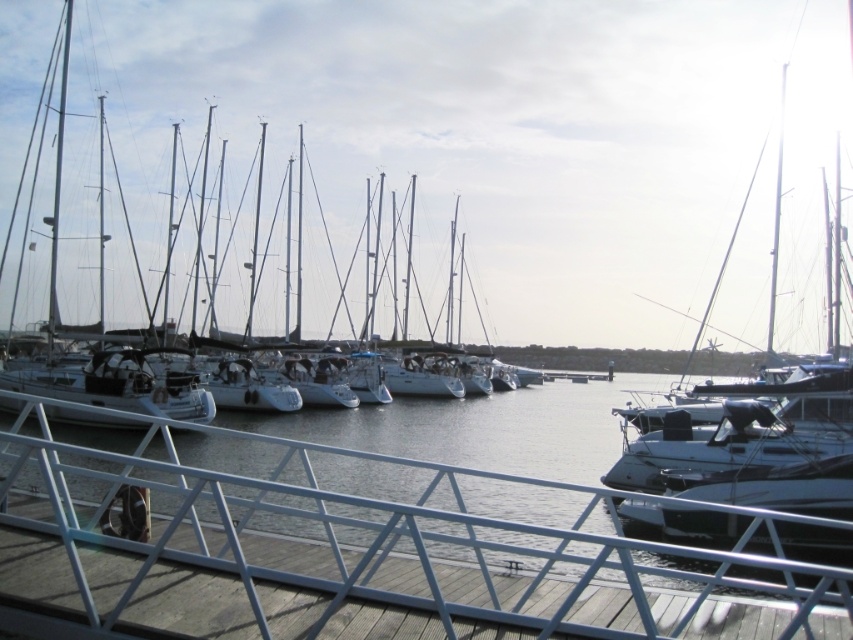
Question: In this image, where is white glossy sailboat at center located relative to white metal rail at lower center?

Choices:
 (A) right
 (B) left

Answer: (A)

Question: Which point is closer to the camera?

Choices:
 (A) (807, 584)
 (B) (303, 268)

Answer: (A)

Question: Where is white glossy sailboat at center located in relation to white metal rail at lower center in the image?

Choices:
 (A) left
 (B) right

Answer: (B)

Question: Does white glossy sailboat at center have a larger size compared to white metal rail at lower center?

Choices:
 (A) yes
 (B) no

Answer: (A)

Question: Among these points, which one is nearest to the camera?

Choices:
 (A) (502, 563)
 (B) (231, 200)

Answer: (A)